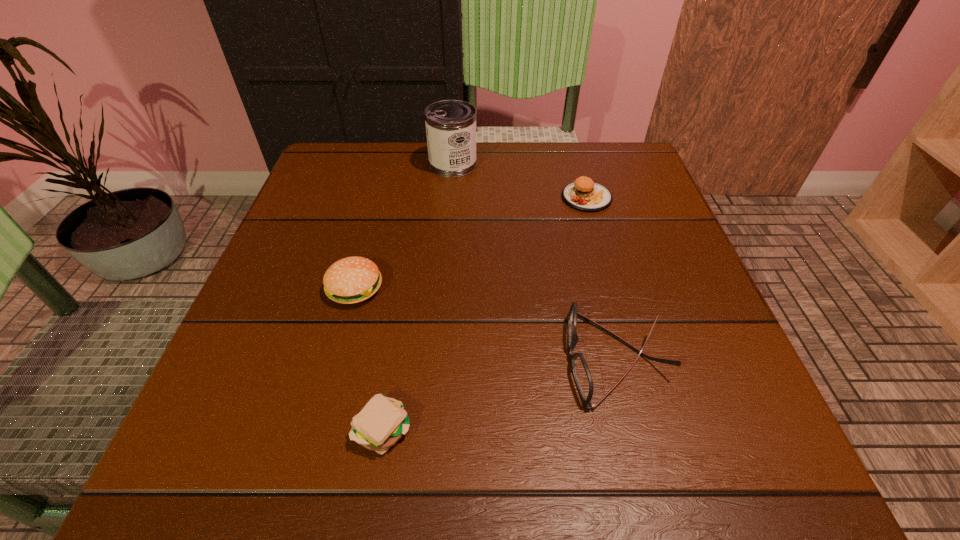
You are a GUI agent. You are given a task and a screenshot of the screen. Output one action in this format:
    pyautogui.click(x=<x>, y=<y>)
    Task: Click on the object that is the third nearest to the spectacles
    The image size is (960, 540).
    Given the screenshot: What is the action you would take?
    pyautogui.click(x=506, y=223)

Locate an element on the screen. The width and height of the screenshot is (960, 540). the third closest object to the spectacles is located at coordinates (506, 223).

Identify the location of patty that stands as the second closest to the farthest object. The width and height of the screenshot is (960, 540). (644, 185).

You are a GUI agent. You are given a task and a screenshot of the screen. Output one action in this format:
    pyautogui.click(x=<x>, y=<y>)
    Task: Click on the closest patty to the leftmost object
    
    Given the screenshot: What is the action you would take?
    pos(644,185)